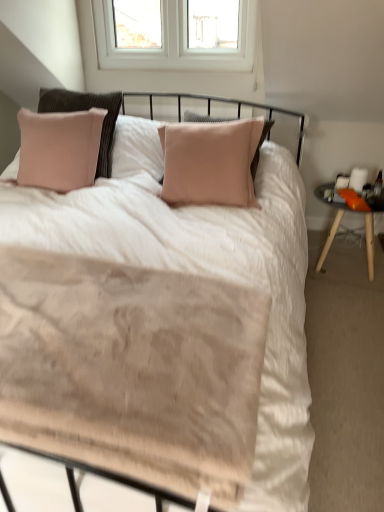
What is the approximate width of beige textured blanket at center?

beige textured blanket at center is 25.29 inches wide.

Locate an element on the screen. beige textured blanket at center is located at coordinates (x=287, y=301).

The width and height of the screenshot is (384, 512). What do you see at coordinates (287, 301) in the screenshot?
I see `beige textured blanket at center` at bounding box center [287, 301].

You are a GUI agent. You are given a task and a screenshot of the screen. Output one action in this format:
    pyautogui.click(x=<x>, y=<y>)
    Task: Click on the orange fabric nightstand at right
    The width and height of the screenshot is (384, 512).
    Given the screenshot: What is the action you would take?
    pyautogui.click(x=365, y=233)

What do you see at coordinates (365, 233) in the screenshot? This screenshot has height=512, width=384. I see `orange fabric nightstand at right` at bounding box center [365, 233].

At what (x,y) coordinates should I click in order to perform the action: click on beige textured blanket at center. Please return your answer as a coordinate pair (x, y). Image resolution: width=384 pixels, height=512 pixels. Looking at the image, I should click on (287, 301).

Considering the positions of objects beige textured blanket at center and orange fabric nightstand at right in the image provided, who is more to the right, beige textured blanket at center or orange fabric nightstand at right?

Positioned to the right is orange fabric nightstand at right.

Considering the relative positions of beige textured blanket at center and orange fabric nightstand at right in the image provided, is beige textured blanket at center in front of orange fabric nightstand at right?

Yes, the depth of beige textured blanket at center is less than that of orange fabric nightstand at right.

Which point is more forward, (230, 241) or (325, 187)?

The point (230, 241) is more forward.

From the image's perspective, which is above, beige textured blanket at center or orange fabric nightstand at right?

orange fabric nightstand at right.

From a real-world perspective, between beige textured blanket at center and orange fabric nightstand at right, who is vertically lower?

orange fabric nightstand at right.

In the scene shown: Considering the sizes of objects beige textured blanket at center and orange fabric nightstand at right in the image provided, who is thinner, beige textured blanket at center or orange fabric nightstand at right?

Thinner between the two is orange fabric nightstand at right.

Considering the sizes of objects beige textured blanket at center and orange fabric nightstand at right in the image provided, who is shorter, beige textured blanket at center or orange fabric nightstand at right?

Standing shorter between the two is beige textured blanket at center.

In the scene shown: Which of these two, beige textured blanket at center or orange fabric nightstand at right, is smaller?

Smaller between the two is beige textured blanket at center.

Would you say beige textured blanket at center is outside orange fabric nightstand at right?

Indeed, beige textured blanket at center is completely outside orange fabric nightstand at right.

Would you consider beige textured blanket at center to be distant from orange fabric nightstand at right?

No, there isn't a large distance between beige textured blanket at center and orange fabric nightstand at right.

Is beige textured blanket at center facing towards orange fabric nightstand at right?

No, beige textured blanket at center is not aimed at orange fabric nightstand at right.

What's the angular difference between beige textured blanket at center and orange fabric nightstand at right's facing directions?

0.741 degrees.

Identify the location of bed in front of the orange fabric nightstand at right. (287, 301).

Based on their positions, is orange fabric nightstand at right located to the left or right of beige textured blanket at center?

Clearly, orange fabric nightstand at right is on the right of beige textured blanket at center in the image.

Is orange fabric nightstand at right positioned behind beige textured blanket at center?

Yes.

Is point (337, 219) positioned in front of point (281, 192)?

That is False.

From the image's perspective, which is below, orange fabric nightstand at right or beige textured blanket at center?

beige textured blanket at center.

From a real-world perspective, does orange fabric nightstand at right sit lower than beige textured blanket at center?

Correct, in the physical world, orange fabric nightstand at right is lower than beige textured blanket at center.

Between orange fabric nightstand at right and beige textured blanket at center, which one has larger width?

Wider between the two is beige textured blanket at center.

Is orange fabric nightstand at right shorter than beige textured blanket at center?

No.

In the scene shown: Who is bigger, orange fabric nightstand at right or beige textured blanket at center?

With larger size is orange fabric nightstand at right.

Is beige textured blanket at center surrounded by orange fabric nightstand at right?

No.

Are orange fabric nightstand at right and beige textured blanket at center located far from each other?

That's not correct — orange fabric nightstand at right is a little close to beige textured blanket at center.

Is orange fabric nightstand at right positioned with its back to beige textured blanket at center?

Answer: orange fabric nightstand at right does not have its back to beige textured blanket at center.

Where is `nightstand to the right of beige textured blanket at center`? This screenshot has height=512, width=384. nightstand to the right of beige textured blanket at center is located at coordinates (365, 233).

This screenshot has width=384, height=512. I want to click on bed below the orange fabric nightstand at right (from the image's perspective), so click(x=287, y=301).

Identify the location of nightstand that is under the beige textured blanket at center (from a real-world perspective). tap(365, 233).